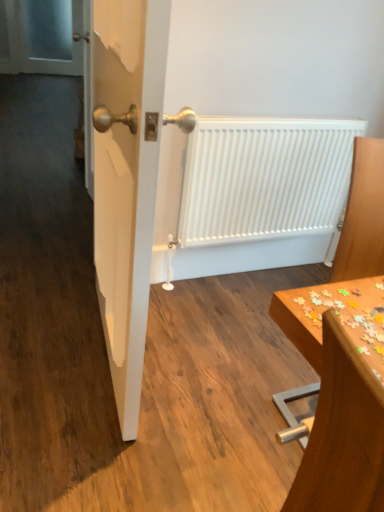
Question: From the image's perspective, is wooden table at right on wooden puzzle pieces at lower right?

Choices:
 (A) no
 (B) yes

Answer: (A)

Question: Is wooden table at right aimed at wooden puzzle pieces at lower right?

Choices:
 (A) yes
 (B) no

Answer: (B)

Question: Considering the relative positions of wooden table at right and wooden puzzle pieces at lower right in the image provided, is wooden table at right behind wooden puzzle pieces at lower right?

Choices:
 (A) no
 (B) yes

Answer: (B)

Question: Is the depth of wooden table at right less than that of wooden puzzle pieces at lower right?

Choices:
 (A) no
 (B) yes

Answer: (A)

Question: Considering the relative positions of wooden table at right and wooden puzzle pieces at lower right in the image provided, is wooden table at right to the left of wooden puzzle pieces at lower right from the viewer's perspective?

Choices:
 (A) no
 (B) yes

Answer: (A)

Question: Does point (67, 16) appear closer or farther from the camera than point (379, 198)?

Choices:
 (A) closer
 (B) farther

Answer: (B)

Question: Based on their sizes in the image, would you say transparent glass screen door at upper left is bigger or smaller than wooden table at right?

Choices:
 (A) big
 (B) small

Answer: (A)

Question: In the image, is transparent glass screen door at upper left positioned in front of or behind wooden table at right?

Choices:
 (A) front
 (B) behind

Answer: (B)

Question: Considering the relative positions of transparent glass screen door at upper left and wooden table at right in the image provided, is transparent glass screen door at upper left to the left or to the right of wooden table at right?

Choices:
 (A) left
 (B) right

Answer: (A)

Question: In terms of width, does white matte radiator at center look wider or thinner when compared to wooden puzzle pieces at lower right?

Choices:
 (A) thin
 (B) wide

Answer: (A)

Question: In the image, is white matte radiator at center positioned in front of or behind wooden puzzle pieces at lower right?

Choices:
 (A) front
 (B) behind

Answer: (B)

Question: From their relative heights in the image, would you say white matte radiator at center is taller or shorter than wooden puzzle pieces at lower right?

Choices:
 (A) tall
 (B) short

Answer: (A)

Question: In terms of size, does white matte radiator at center appear bigger or smaller than wooden puzzle pieces at lower right?

Choices:
 (A) small
 (B) big

Answer: (B)

Question: From their relative heights in the image, would you say wooden table at right is taller or shorter than white glossy door at center?

Choices:
 (A) short
 (B) tall

Answer: (A)

Question: Based on their sizes in the image, would you say wooden table at right is bigger or smaller than white glossy door at center?

Choices:
 (A) big
 (B) small

Answer: (B)